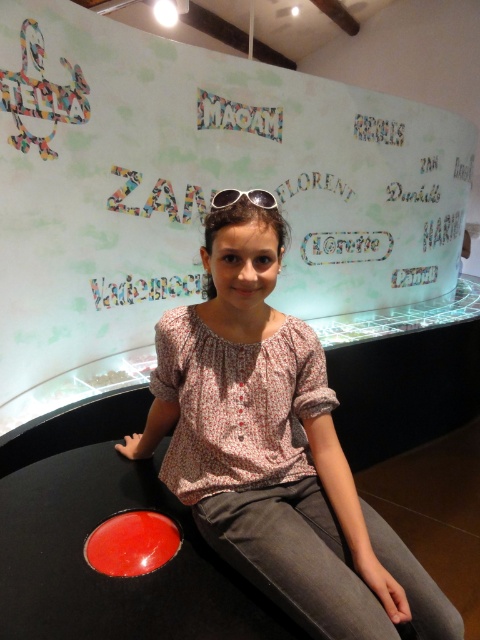
You are standing in front of the metallic glass display case at center and the pink floral blouse at center. Which object is closer to you?

The metallic glass display case at center is closer to you because it is further to the viewer than the pink floral blouse at center.

You are a photographer trying to capture a clear shot of the pink floral blouse at center and the silver reflective sunglasses at center. Since both are at the center, which one will be in focus if you focus on the person sitting on the bench?

The pink floral blouse at center will be in focus because it is closer to the viewer than the silver reflective sunglasses at center.

You are a photographer trying to capture a clear shot of the pink floral blouse at center and the silver reflective sunglasses at center. Considering their sizes, which object should you focus on first to ensure both are in frame without needing to adjust the camera angle?

The pink floral blouse at center is larger than the silver reflective sunglasses at center, so you should focus on the pink floral blouse at center first to ensure it fits within the frame before adjusting for the smaller sunglasses.